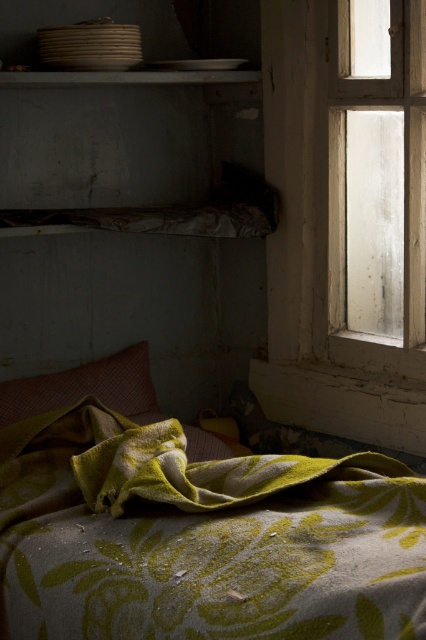
Consider the image. Based on the scene description, where is the wooden frame window at right located relative to the smooth white shelf at upper center?

The wooden frame window at right is located to the right of the smooth white shelf at upper center.

In the dimly lit abandoned room, there is a red plaid pillow at center and a smooth white shelf at upper center. Which object is positioned to the left of the other?

The red plaid pillow at center is to the left of smooth white shelf at upper center.